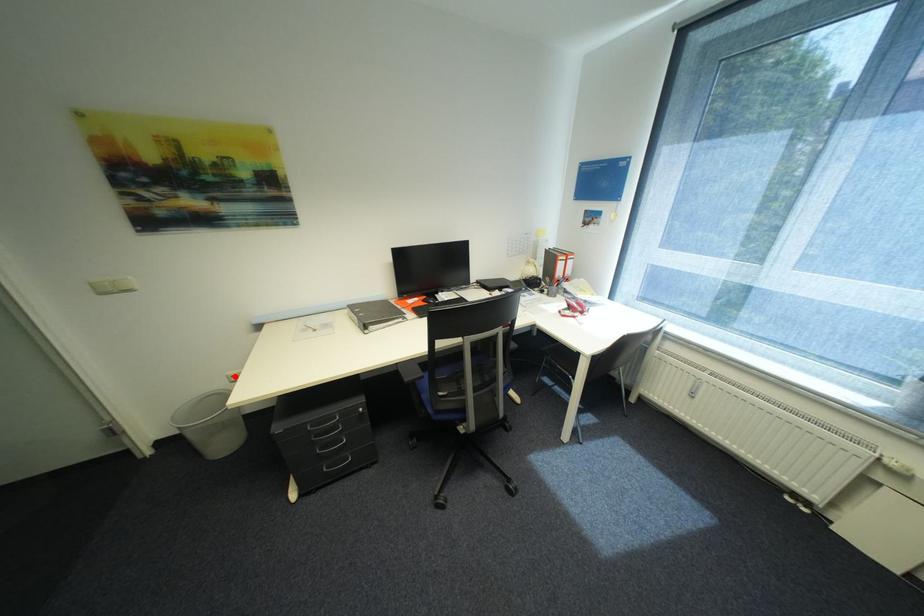
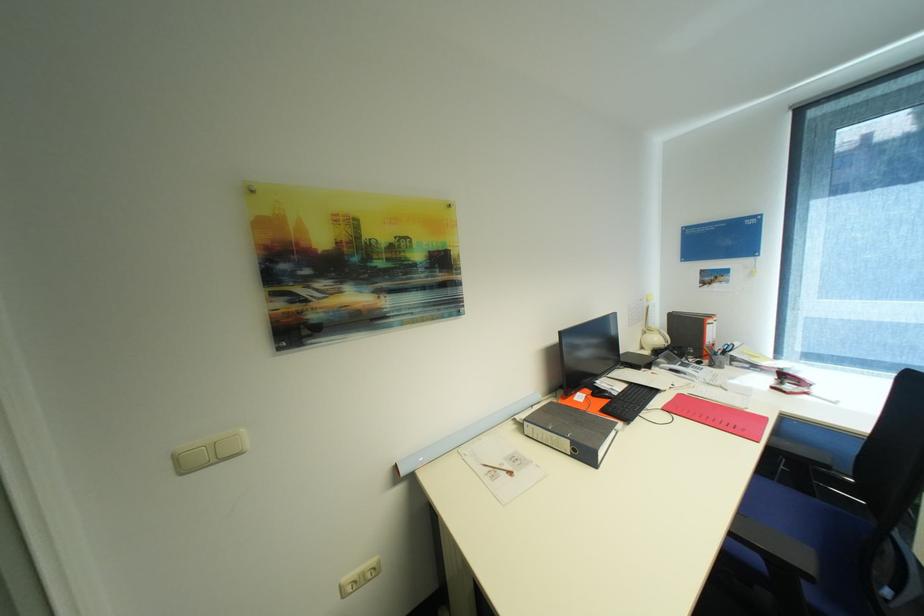
Question: I am providing you with two images of the same scene from different viewpoints. A red point is shown in image1. For the corresponding object point in image2, is it positioned nearer or farther from the camera?

Choices:
 (A) Nearer
 (B) Farther

Answer: (A)